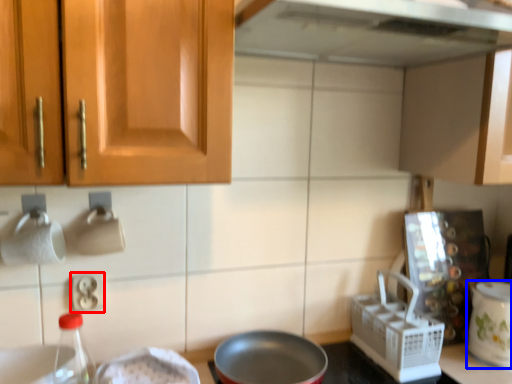
Question: Which object is closer to the camera taking this photo, electric outlet (highlighted by a red box) or kitchen appliance (highlighted by a blue box)?

Choices:
 (A) electric outlet
 (B) kitchen appliance

Answer: (A)